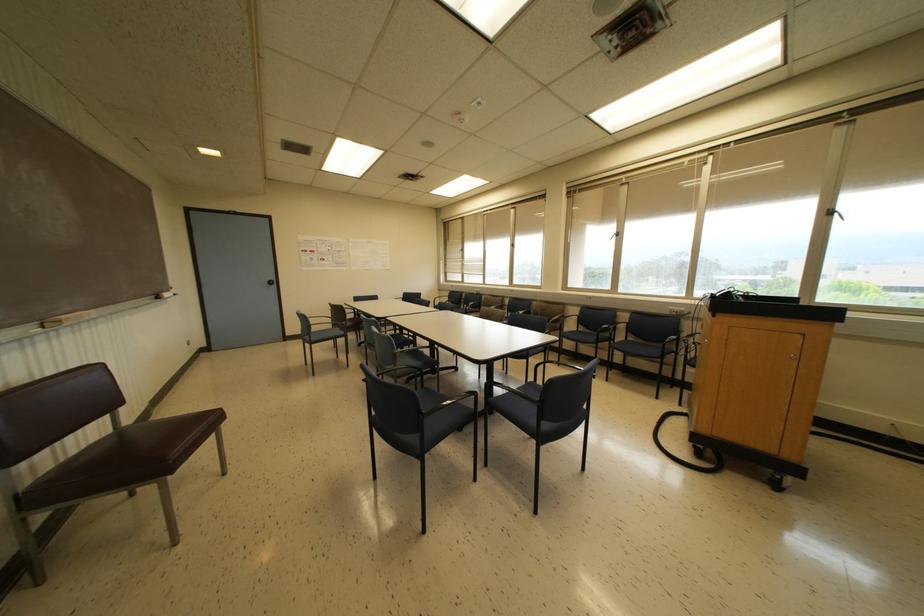
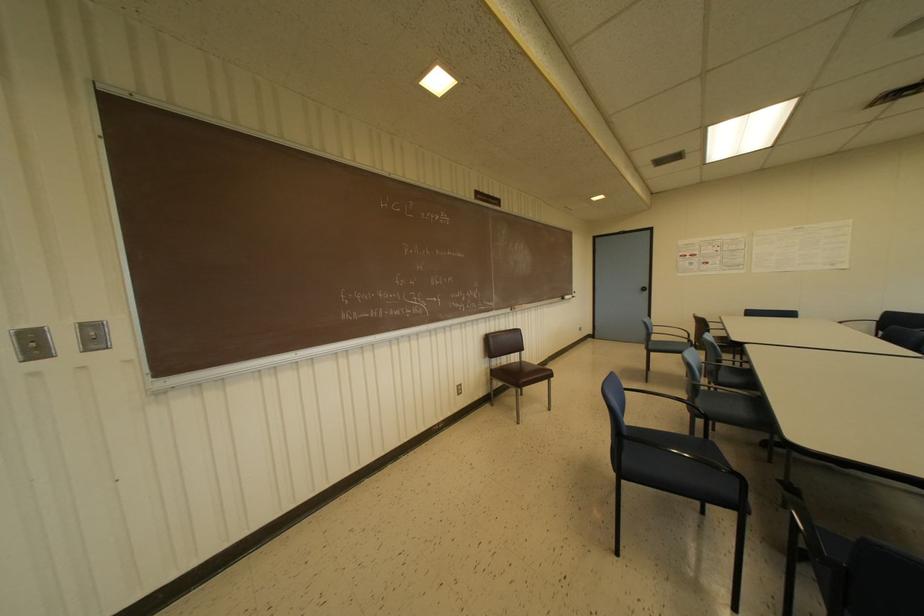
Find the pixel in the second image that matches point (166, 294) in the first image.

(565, 296)